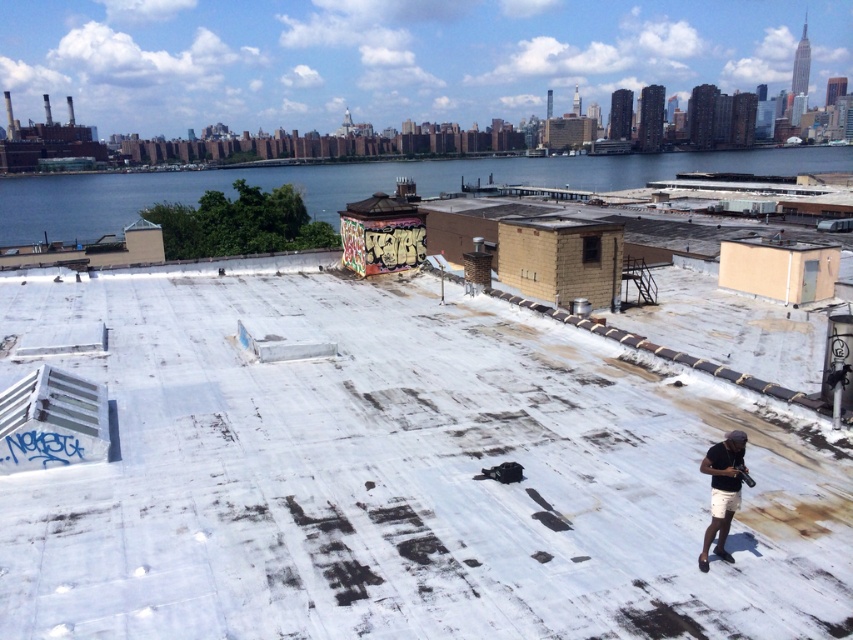
Who is more forward, (155, 609) or (602, 157)?

Point (155, 609) is more forward.

Does white matte roof at center have a greater height compared to blue water at upper center?

No.

Find the location of a particular element. The height and width of the screenshot is (640, 853). white matte roof at center is located at coordinates (403, 477).

Which of these two, white matte roof at center or dark gray matte shorts at lower right, stands taller?

Standing taller between the two is white matte roof at center.

Where is `white matte roof at center`? Image resolution: width=853 pixels, height=640 pixels. white matte roof at center is located at coordinates (403, 477).

Identify the location of white matte roof at center. (403, 477).

Between blue water at upper center and dark gray matte shorts at lower right, which one is positioned higher?

Positioned higher is blue water at upper center.

Does point (792, 163) come closer to viewer compared to point (741, 458)?

No.

Where is `blue water at upper center`? blue water at upper center is located at coordinates (357, 182).